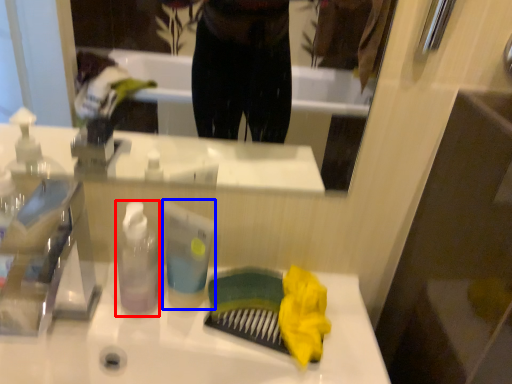
Question: Which object is further to the camera taking this photo, bottle (highlighted by a red box) or toiletry (highlighted by a blue box)?

Choices:
 (A) bottle
 (B) toiletry

Answer: (B)